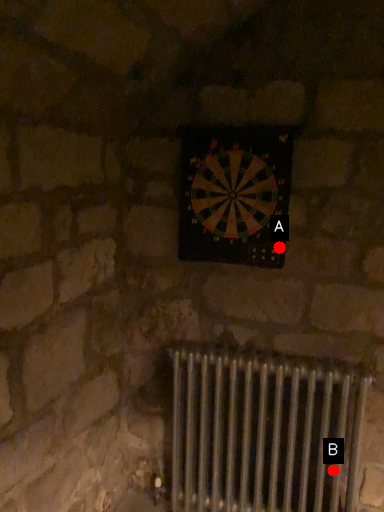
Question: Two points are circled on the image, labeled by A and B beside each circle. Which point is further to the camera?

Choices:
 (A) A is further
 (B) B is further

Answer: (B)